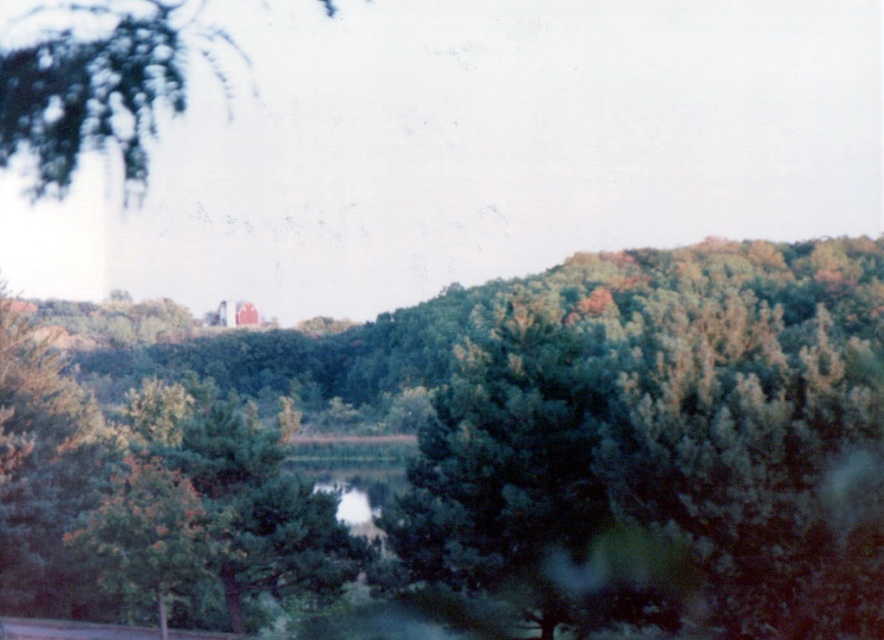
Between point (791, 451) and point (136, 17), which one is positioned behind?

Point (791, 451)

Does green leafy forest at center appear on the left side of green leafy tree at upper left?

Incorrect, green leafy forest at center is not on the left side of green leafy tree at upper left.

Describe the element at coordinates (531, 449) in the screenshot. Image resolution: width=884 pixels, height=640 pixels. I see `green leafy forest at center` at that location.

The height and width of the screenshot is (640, 884). In order to click on green leafy forest at center in this screenshot , I will do `click(531, 449)`.